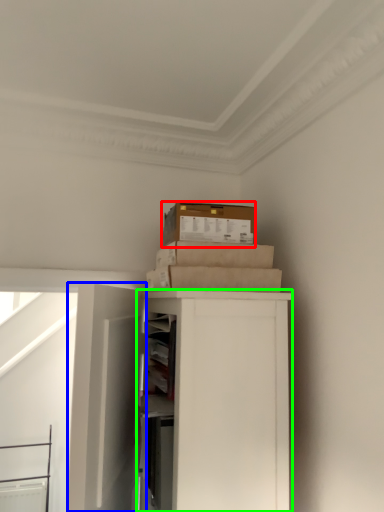
Question: Which is farther away from box (highlighted by a red box)? door (highlighted by a blue box) or cabinetry (highlighted by a green box)?

Choices:
 (A) door
 (B) cabinetry

Answer: (A)